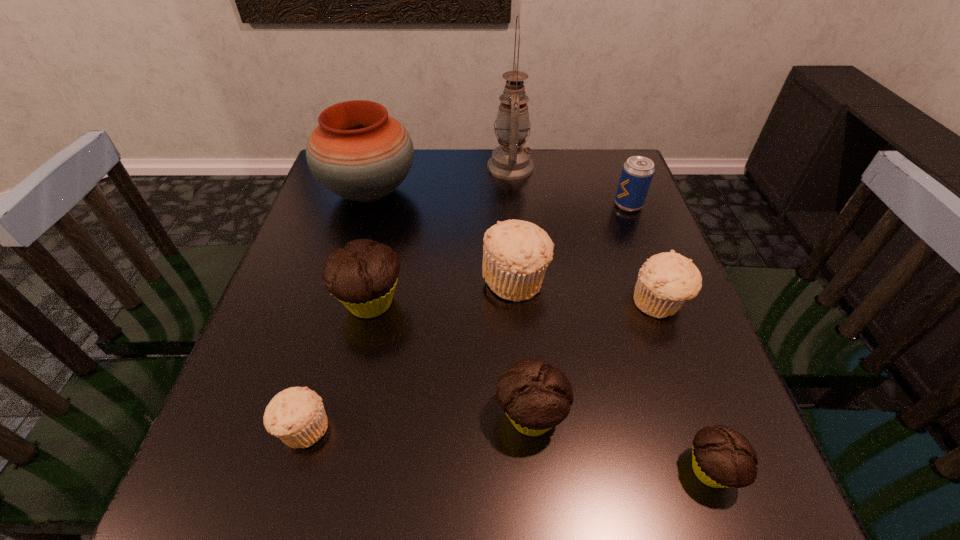
The height and width of the screenshot is (540, 960). I want to click on free space located 0.190m on the right of the leftmost beige muffin, so click(x=444, y=428).

The image size is (960, 540). Identify the location of vacant space located 0.050m on the back of the rightmost chocolate muffin. (691, 414).

The height and width of the screenshot is (540, 960). I want to click on oil lamp present at the far edge, so click(x=510, y=161).

Where is `pottery positioned at the far edge`? pottery positioned at the far edge is located at coordinates [x=358, y=152].

Find the location of a particular element. The height and width of the screenshot is (540, 960). beer can that is at the far edge is located at coordinates (637, 173).

Image resolution: width=960 pixels, height=540 pixels. I want to click on object positioned at the near edge, so click(721, 457).

Identify the location of pottery present at the left edge. (358, 152).

At what (x,y) coordinates should I click in order to perform the action: click on beer can that is at the right edge. Please return your answer as a coordinate pair (x, y). Looking at the image, I should click on (637, 173).

I want to click on object at the far left corner, so click(358, 152).

In order to click on object located in the far right corner section of the desktop in this screenshot , I will do `click(637, 173)`.